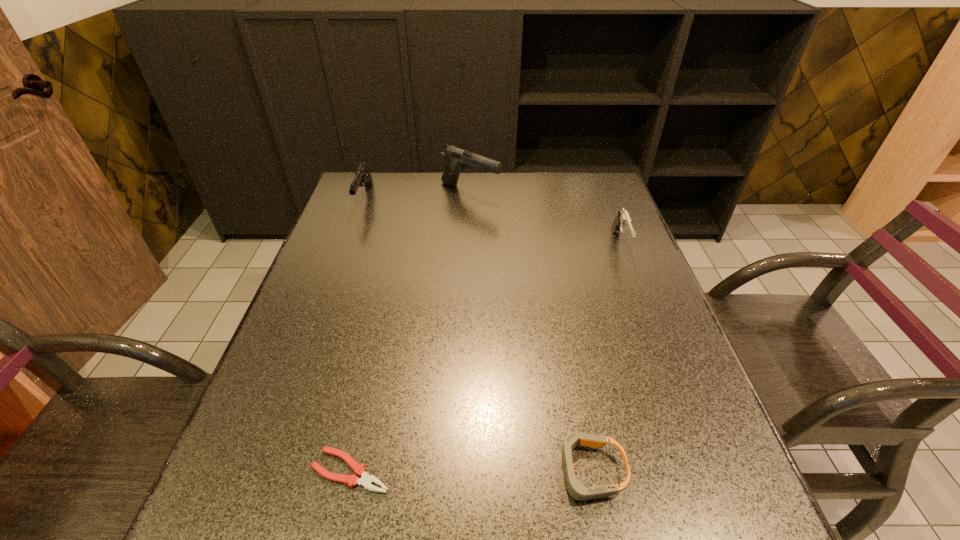
Locate an element on the screen. The image size is (960, 540). the second gun from left to right is located at coordinates (457, 159).

Locate an element on the screen. This screenshot has height=540, width=960. the tallest gun is located at coordinates (457, 159).

Image resolution: width=960 pixels, height=540 pixels. I want to click on the leftmost gun, so click(363, 177).

The width and height of the screenshot is (960, 540). I want to click on the rightmost gun, so click(622, 223).

Identify the location of the third farthest object. This screenshot has height=540, width=960. (622, 223).

Find the location of a particular element. The image size is (960, 540). goggles is located at coordinates (576, 489).

You are a GUI agent. You are given a task and a screenshot of the screen. Output one action in this format:
    pyautogui.click(x=<x>, y=<y>)
    Task: Click on the fourth tallest object
    The width and height of the screenshot is (960, 540).
    Given the screenshot: What is the action you would take?
    pyautogui.click(x=576, y=489)

At what (x,y) coordinates should I click in order to perform the action: click on the shortest object. Please return your answer as a coordinate pair (x, y). Looking at the image, I should click on (366, 480).

Find the location of a particular element. This screenshot has height=540, width=960. the second object from left to right is located at coordinates (366, 480).

Identify the location of blank area located at the muzzle of the tallest gun. The width and height of the screenshot is (960, 540). (521, 192).